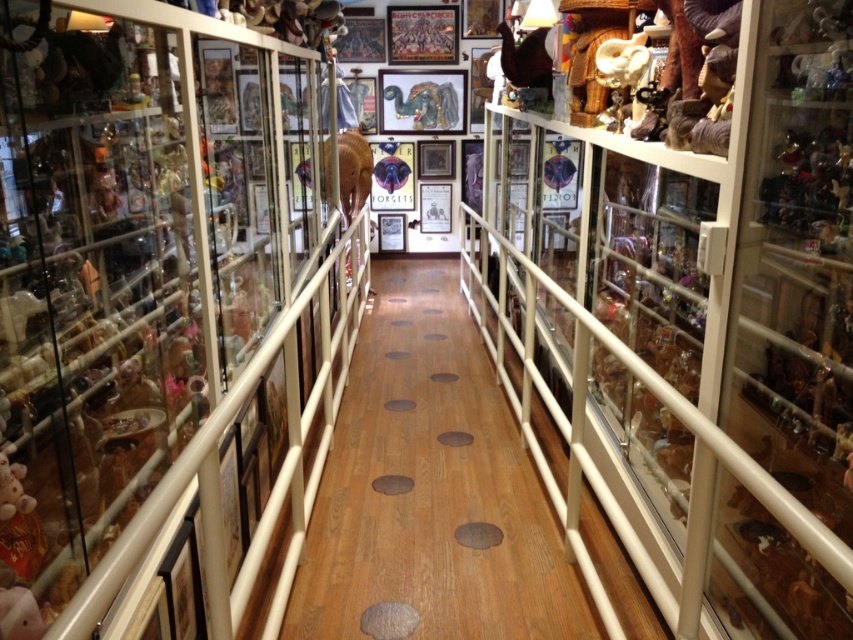
You are a delivery person carrying a large package that is 10 feet long. You need to navigate through the narrow hallway and pass between the clear glass shelves at center and the matte brown elephant at center. Can your package fit through the space between them?

The clear glass shelves at center and the matte brown elephant at center are 10.37 feet apart from each other. Since the package is 10 feet long, it can fit through the space between them as there is enough clearance.

You are a delivery person trying to place a large package on the clear glass shelves at center. However, you notice the matte brown elephant at center is blocking the way. Can you place the package on the shelves without moving the elephant?

The clear glass shelves at center is in front of the matte brown elephant at center, so the elephant is behind the shelves. Therefore, you can place the package on the shelves without moving the elephant.

You are a delivery person carrying a large box that is 1.2 meters wide. You need to navigate through the narrow hallway and pass between the clear glass shelves at center and the matte brown elephant at center. Can your box fit through the space between them?

The clear glass shelves at center is bigger than the matte brown elephant at center, but the exact distance between them isn not specified. Without knowing the actual space between the two objects, it is impossible to determine if the 1.2 meter wide box can fit through.